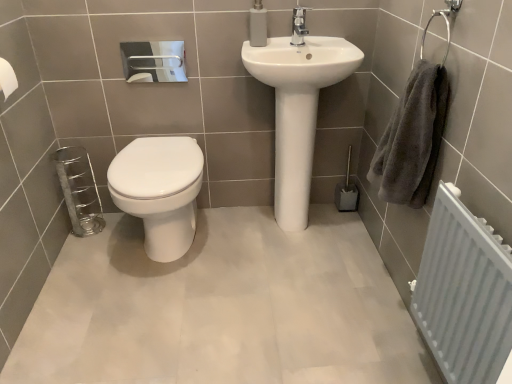
Question: Is white textured radiator at right at the back of white glossy sink at center?

Choices:
 (A) yes
 (B) no

Answer: (B)

Question: From a real-world perspective, is white glossy sink at center under white textured radiator at right?

Choices:
 (A) no
 (B) yes

Answer: (A)

Question: From a real-world perspective, is white glossy sink at center positioned over white textured radiator at right based on gravity?

Choices:
 (A) no
 (B) yes

Answer: (B)

Question: Can you confirm if white glossy sink at center is wider than white textured radiator at right?

Choices:
 (A) no
 (B) yes

Answer: (B)

Question: From the image's perspective, would you say white glossy sink at center is shown under white textured radiator at right?

Choices:
 (A) yes
 (B) no

Answer: (B)

Question: Considering the positions of white textured radiator at right and white glossy sink at center in the image, is white textured radiator at right wider or thinner than white glossy sink at center?

Choices:
 (A) thin
 (B) wide

Answer: (A)

Question: From a real-world perspective, is white textured radiator at right above or below white glossy sink at center?

Choices:
 (A) above
 (B) below

Answer: (B)

Question: Which is correct: white textured radiator at right is inside white glossy sink at center, or outside of it?

Choices:
 (A) outside
 (B) inside

Answer: (A)

Question: Does point (443, 278) appear closer or farther from the camera than point (257, 28)?

Choices:
 (A) closer
 (B) farther

Answer: (A)

Question: In terms of size, does polished chrome faucet at upper center appear bigger or smaller than white glossy toilet at center?

Choices:
 (A) small
 (B) big

Answer: (A)

Question: From a real-world perspective, relative to white glossy toilet at center, is polished chrome faucet at upper center vertically above or below?

Choices:
 (A) below
 (B) above

Answer: (B)

Question: Is polished chrome faucet at upper center taller or shorter than white glossy toilet at center?

Choices:
 (A) short
 (B) tall

Answer: (A)

Question: Is polished chrome faucet at upper center to the left or to the right of white glossy toilet at center in the image?

Choices:
 (A) left
 (B) right

Answer: (B)

Question: Is gray fluffy towel at right wider or thinner than white glossy sink at center?

Choices:
 (A) thin
 (B) wide

Answer: (A)

Question: From a real-world perspective, is gray fluffy towel at right above or below white glossy sink at center?

Choices:
 (A) above
 (B) below

Answer: (A)